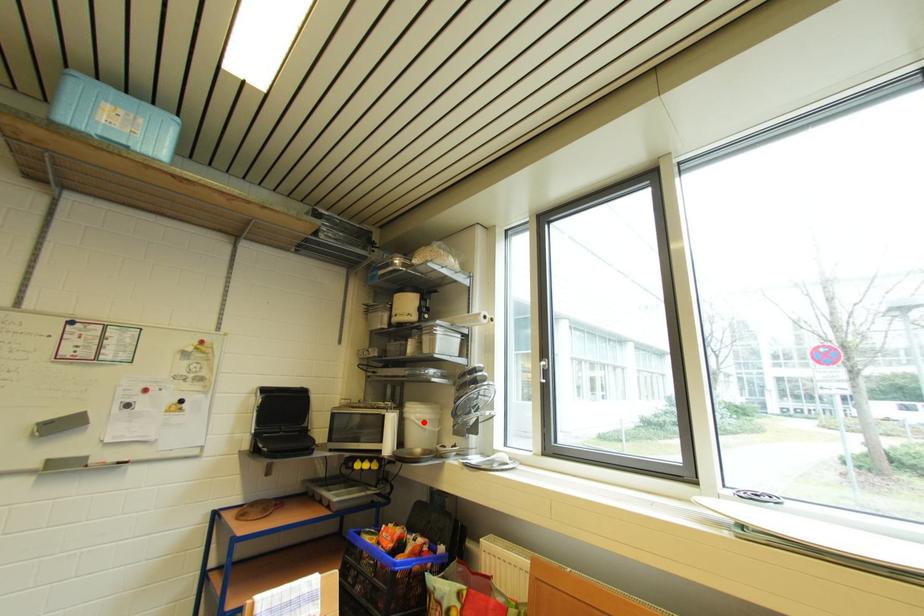
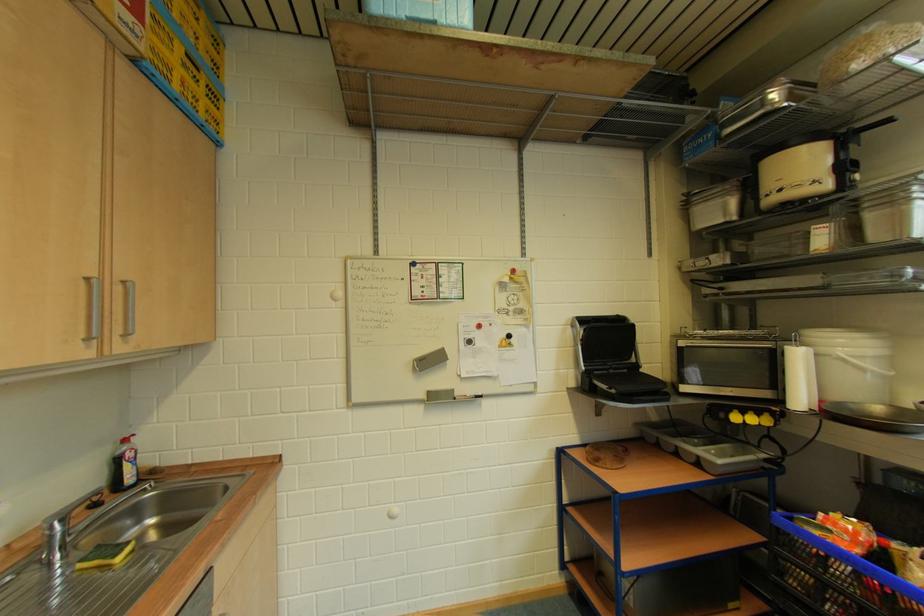
Locate, in the second image, the point that corresponds to the highlighted location in the first image.

(858, 360)